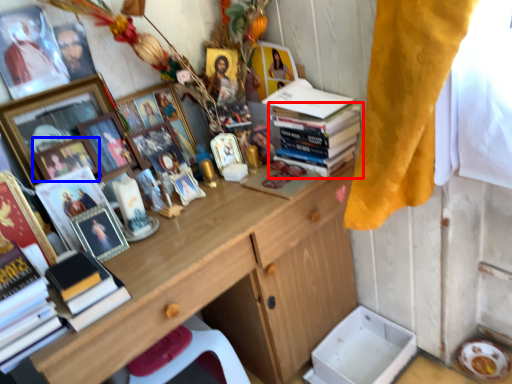
Question: Which object is closer to the camera taking this photo, book (highlighted by a red box) or picture frame (highlighted by a blue box)?

Choices:
 (A) book
 (B) picture frame

Answer: (B)